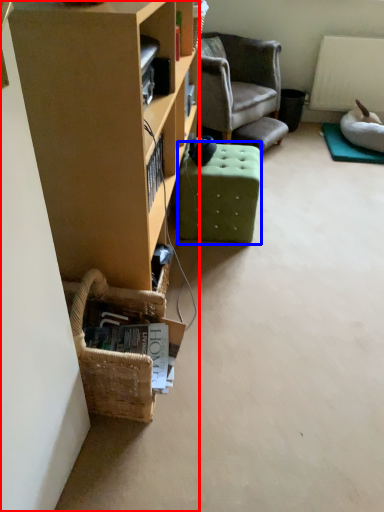
Question: Which of the following is the closest to the observer, cabinetry (highlighted by a red box) or stool (highlighted by a blue box)?

Choices:
 (A) cabinetry
 (B) stool

Answer: (A)